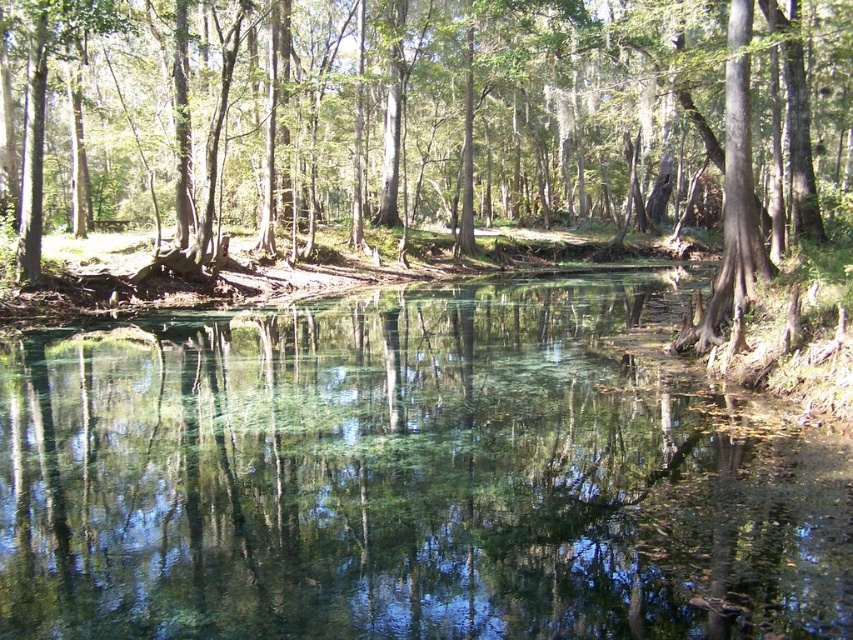
Who is higher up, clear glass lake at center or green leafy tree at center?

green leafy tree at center

Between clear glass lake at center and green leafy tree at center, which one appears on the left side from the viewer's perspective?

Positioned to the left is clear glass lake at center.

Which is behind, point (335, 388) or point (409, 218)?

Point (409, 218)

I want to click on clear glass lake at center, so click(407, 477).